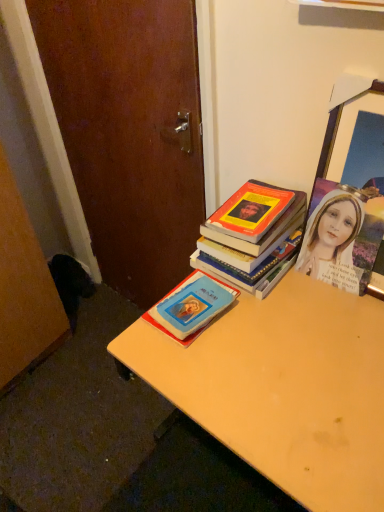
Question: Does light brown wooden desk at center touch hardcover book at center, which ranks as the 1th book in top-to-bottom order?

Choices:
 (A) no
 (B) yes

Answer: (A)

Question: Can we say light brown wooden desk at center lies outside hardcover book at center, which ranks as the 1th book in top-to-bottom order?

Choices:
 (A) yes
 (B) no

Answer: (A)

Question: Is the depth of light brown wooden desk at center less than that of hardcover book at center, which ranks as the 1th book in top-to-bottom order?

Choices:
 (A) yes
 (B) no

Answer: (A)

Question: Is the depth of light brown wooden desk at center greater than that of hardcover book at center, which ranks as the 1th book in top-to-bottom order?

Choices:
 (A) yes
 (B) no

Answer: (B)

Question: Does light brown wooden desk at center have a lesser width compared to hardcover book at center, which ranks as the 1th book in top-to-bottom order?

Choices:
 (A) yes
 (B) no

Answer: (B)

Question: From the image's perspective, is light brown wooden desk at center on hardcover book at center, which is the second book from bottom to top?

Choices:
 (A) yes
 (B) no

Answer: (B)

Question: Is blue matte book at center, the first book ordered from the bottom, taller than wooden picture frame at upper right?

Choices:
 (A) no
 (B) yes

Answer: (A)

Question: Is blue matte book at center, the first book ordered from the bottom, touching wooden picture frame at upper right?

Choices:
 (A) no
 (B) yes

Answer: (A)

Question: Is blue matte book at center, the first book ordered from the bottom, not near wooden picture frame at upper right?

Choices:
 (A) yes
 (B) no

Answer: (B)

Question: From a real-world perspective, is blue matte book at center, arranged as the second book when viewed from the top, under wooden picture frame at upper right?

Choices:
 (A) yes
 (B) no

Answer: (A)

Question: Does blue matte book at center, arranged as the second book when viewed from the top, turn towards wooden picture frame at upper right?

Choices:
 (A) yes
 (B) no

Answer: (B)

Question: Is blue matte book at center, arranged as the second book when viewed from the top, at the right side of wooden picture frame at upper right?

Choices:
 (A) yes
 (B) no

Answer: (B)

Question: From a real-world perspective, is blue matte book at center, arranged as the second book when viewed from the top, physically above light brown wooden desk at center?

Choices:
 (A) no
 (B) yes

Answer: (B)